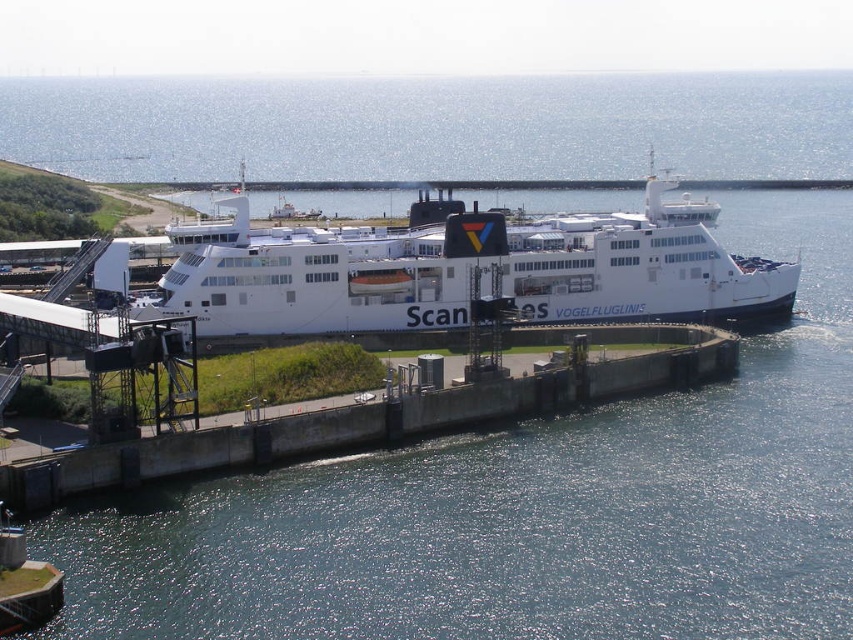
Question: Observing the image, what is the correct spatial positioning of white matte ferry at center in reference to concrete at center?

Choices:
 (A) right
 (B) left

Answer: (A)

Question: Is white matte ferry at center below concrete at center?

Choices:
 (A) no
 (B) yes

Answer: (A)

Question: Which of the following is the closest to the observer?

Choices:
 (A) (231, 246)
 (B) (408, 438)

Answer: (B)

Question: Does white matte ferry at center have a smaller size compared to concrete at center?

Choices:
 (A) no
 (B) yes

Answer: (A)

Question: Which point is closer to the camera?

Choices:
 (A) white matte ferry at center
 (B) concrete at center

Answer: (B)

Question: Which point is closer to the camera?

Choices:
 (A) white matte ferry at center
 (B) concrete at center

Answer: (B)